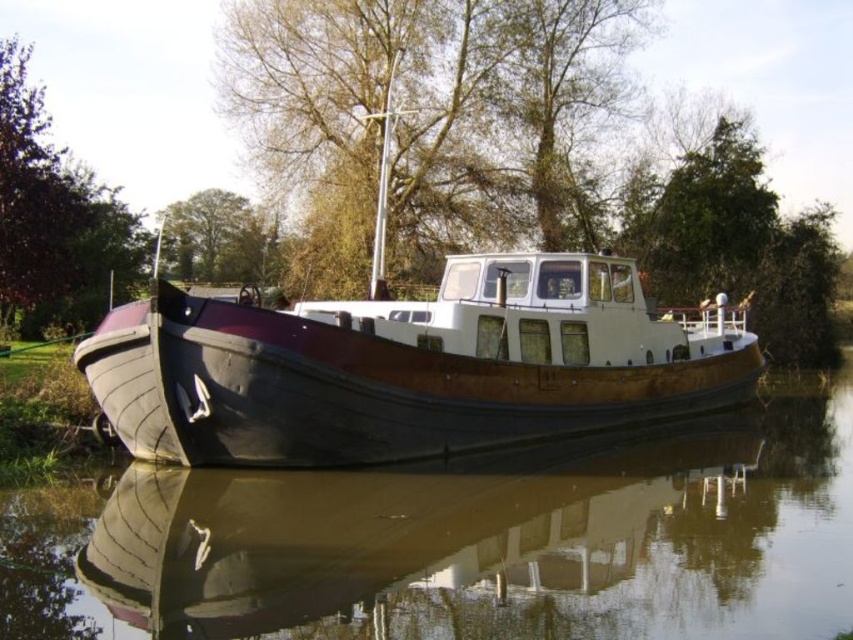
Question: Among these points, which one is nearest to the camera?

Choices:
 (A) (354, 385)
 (B) (459, 122)

Answer: (A)

Question: Which point is farther from the camera taking this photo?

Choices:
 (A) (645, 420)
 (B) (258, 236)
 (C) (498, 118)

Answer: (B)

Question: Does brown wooden boat at center lie in front of brown textured tree at upper center?

Choices:
 (A) yes
 (B) no

Answer: (A)

Question: In this image, where is wooden boat at center located relative to brown textured tree at upper center?

Choices:
 (A) above
 (B) below

Answer: (B)

Question: In this image, where is brown textured tree at upper center located relative to green leafy tree at upper center?

Choices:
 (A) left
 (B) right

Answer: (B)

Question: Which point is closer to the camera?

Choices:
 (A) wooden boat at center
 (B) brown textured tree at upper center

Answer: (A)